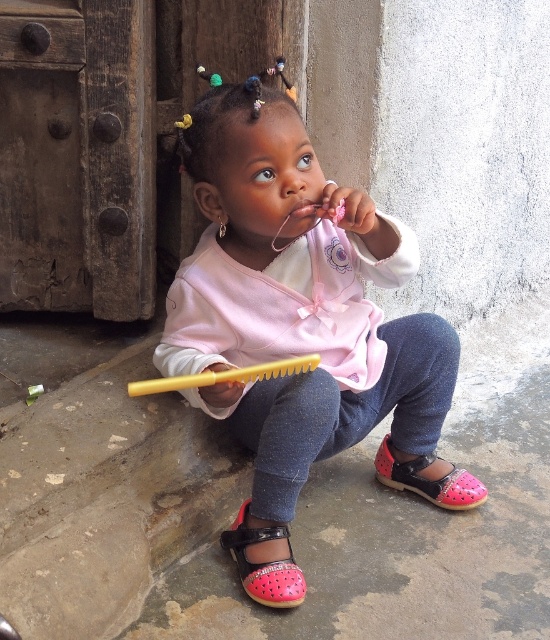
Question: Is pink leather sandal at lower center wider than pink leather sandal at lower right?

Choices:
 (A) yes
 (B) no

Answer: (B)

Question: Which is nearer to the pink fabric at center?

Choices:
 (A) pink leather sandal at lower right
 (B) pink leather sandal at lower center
 (C) yellow plastic brush at lower center
 (D) pink glossy lips at center

Answer: (C)

Question: Does pink leather sandal at lower right have a smaller size compared to yellow plastic brush at lower center?

Choices:
 (A) yes
 (B) no

Answer: (A)

Question: Which of the following is the farthest from the observer?

Choices:
 (A) pink leather sandal at lower right
 (B) pink glossy lips at center
 (C) pink fabric at center

Answer: (A)

Question: Is pink fabric at center wider than pink leather sandal at lower right?

Choices:
 (A) yes
 (B) no

Answer: (A)

Question: Estimate the real-world distances between objects in this image. Which object is farther from the pink leather sandal at lower center?

Choices:
 (A) pink fabric at center
 (B) pink glossy lips at center

Answer: (B)